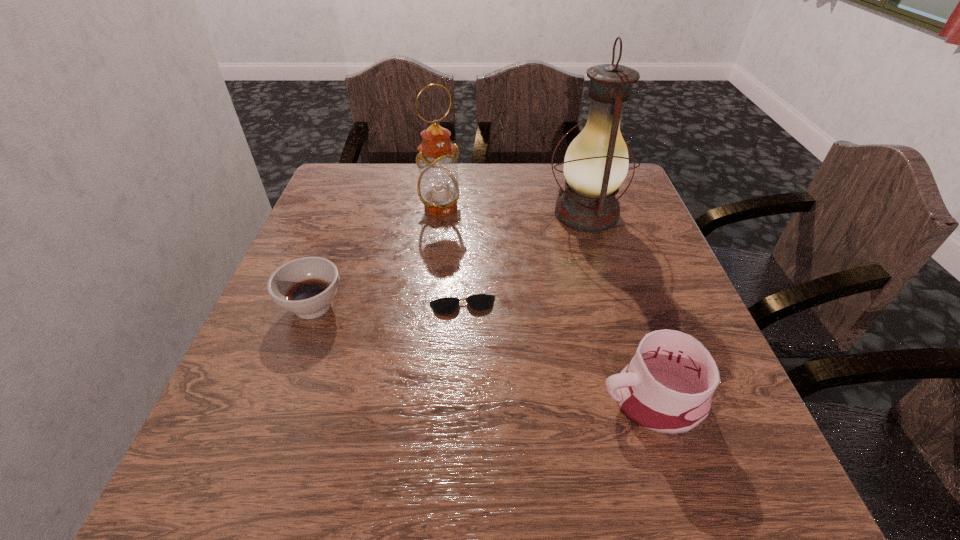
Find the location of `unoccupied position between the second tallest object and the spectacles`. unoccupied position between the second tallest object and the spectacles is located at coordinates (451, 256).

This screenshot has height=540, width=960. In order to click on free space between the right oil lamp and the mug in this screenshot , I will do `click(619, 307)`.

Identify the location of vacant area between the shortest object and the taller oil lamp. (524, 260).

Locate an element on the screen. This screenshot has height=540, width=960. free space between the nearest object and the tallest object is located at coordinates (619, 307).

Identify the location of object that is the fourth closest to the second tallest object. This screenshot has height=540, width=960. (667, 387).

This screenshot has height=540, width=960. I want to click on the third closest object to the second tallest object, so click(479, 302).

Find the location of a particular element. The height and width of the screenshot is (540, 960). vacant space that satisfies the following two spatial constraints: 1. on the back side of the right oil lamp; 2. on the right side of the spectacles is located at coordinates (466, 214).